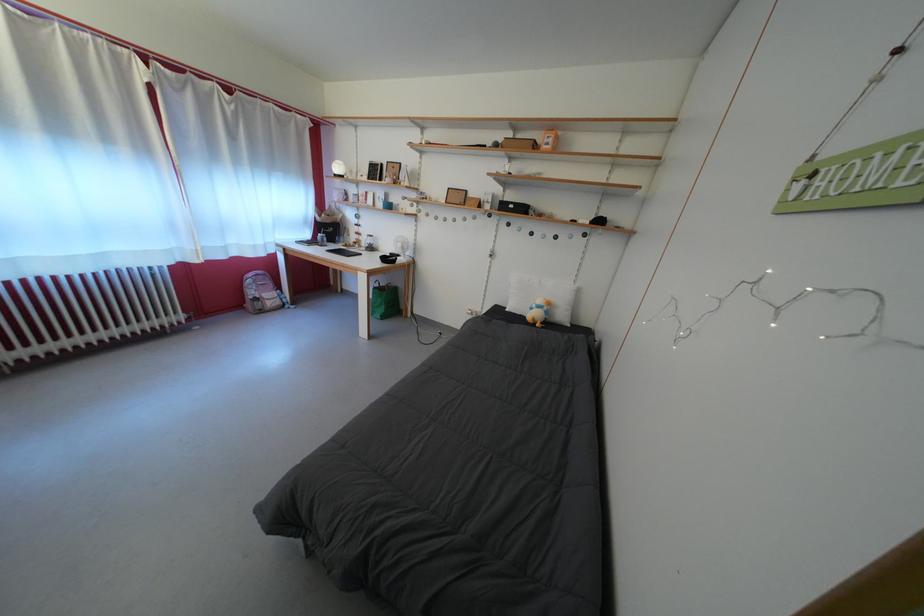
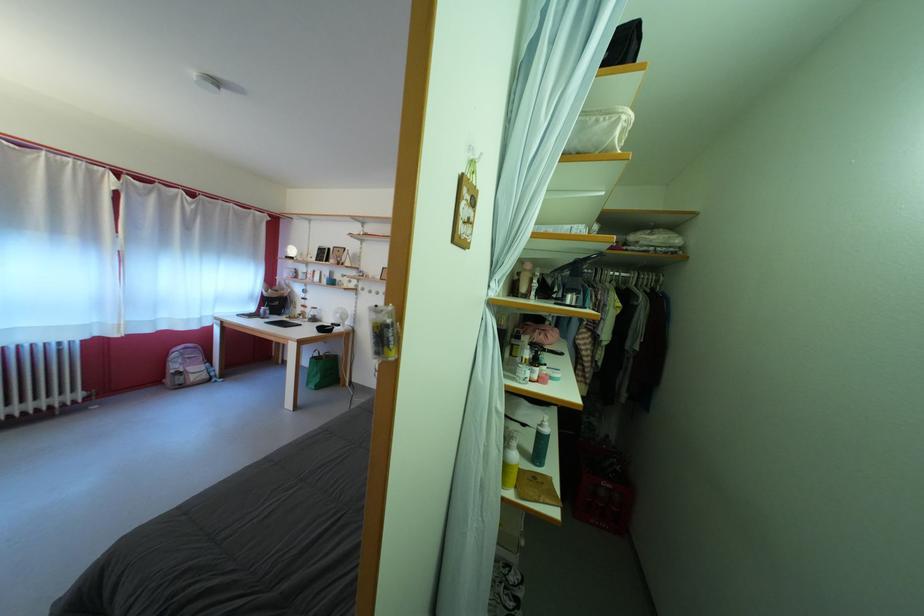
Find the pixel in the second image that matches point (380, 254) in the first image.

(322, 325)